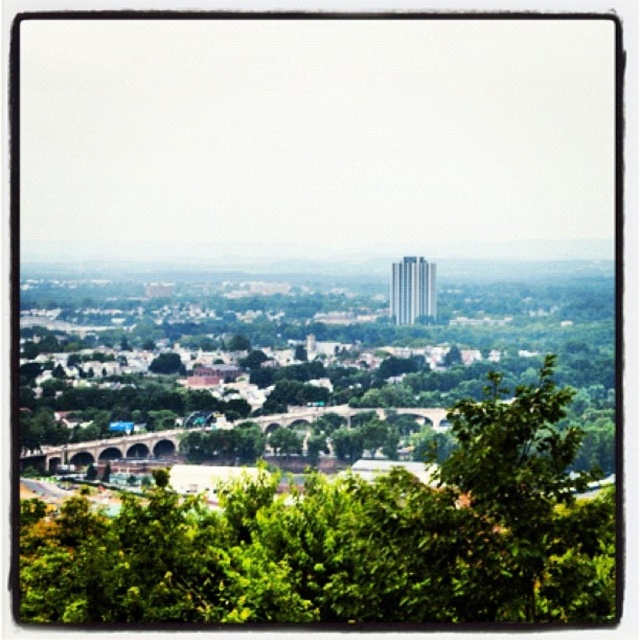
Question: Is green leafy tree at center below green leafy tree at lower right?

Choices:
 (A) yes
 (B) no

Answer: (A)

Question: Which point is closer to the camera?

Choices:
 (A) (237, 518)
 (B) (492, 428)

Answer: (A)

Question: Which of the following is the farthest from the observer?

Choices:
 (A) (141, 563)
 (B) (458, 413)

Answer: (A)

Question: Does green leafy tree at center have a larger size compared to green leafy tree at lower right?

Choices:
 (A) no
 (B) yes

Answer: (B)

Question: Is green leafy tree at center closer to the viewer compared to green leafy tree at lower right?

Choices:
 (A) no
 (B) yes

Answer: (B)